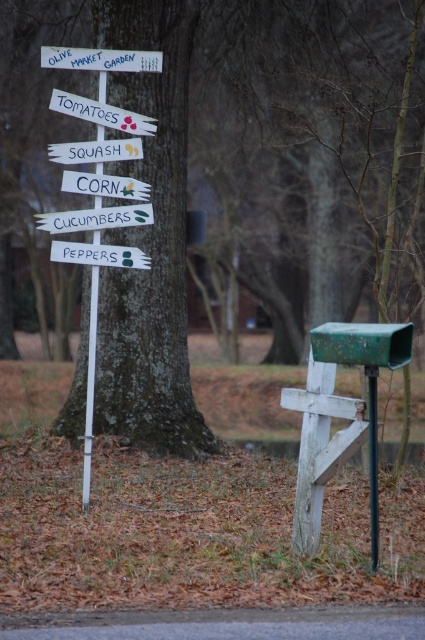
You are a hiker who just arrived at the signpost and wants to check the mailbox. Which object should you look for first, the green bark tree at center or the brown rough tree trunk at center?

The brown rough tree trunk at center is located below the green bark tree at center, so you should look for the brown rough tree trunk at center first since it is lower and closer to the ground.

You are a gardener who needs to place a new decorative rock between the white wooden sign at upper center and the black plastic pole at center. The rock is 3 feet wide. Will it fit between them without overlapping either object?

The distance between the white wooden sign at upper center and the black plastic pole at center is 8.83 feet. Since the rock is only 3 feet wide, there will be enough space to place it between them without overlapping either object.

You are a gardener who wants to hang a new decorative wreath on the white wooden sign at upper center and the black plastic pole at center. Considering their sizes, which object will allow the wreath to fit better?

The white wooden sign at upper center has a larger width than the black plastic pole at center, so the wreath will fit better on the white wooden sign at upper center.